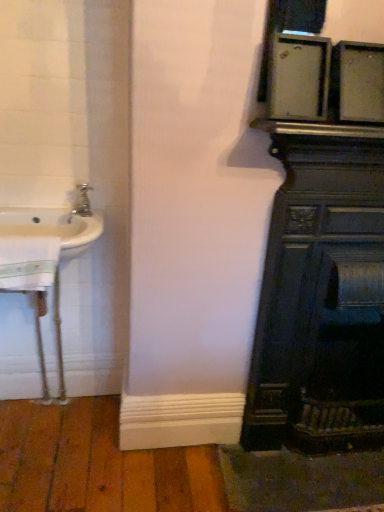
The image size is (384, 512). Describe the element at coordinates (81, 202) in the screenshot. I see `brushed metal faucet at left` at that location.

Where is `white glossy sink at left`? The height and width of the screenshot is (512, 384). white glossy sink at left is located at coordinates (57, 223).

Is white glossy sink at left far away from dark wood fireplace at right?

Actually, white glossy sink at left and dark wood fireplace at right are a little close together.

Is white glossy sink at left at the left side of dark wood fireplace at right?

Yes, white glossy sink at left is to the left of dark wood fireplace at right.

Consider the image. Choose the correct answer: Is white glossy sink at left inside dark wood fireplace at right or outside it?

white glossy sink at left lies outside dark wood fireplace at right.

Is brushed metal faucet at left with dark wood fireplace at right?

brushed metal faucet at left and dark wood fireplace at right are not in contact.

Consider the image. From a real-world perspective, is brushed metal faucet at left below dark wood fireplace at right?

No, from a real-world perspective, brushed metal faucet at left is not under dark wood fireplace at right.

Which object is wider, brushed metal faucet at left or dark wood fireplace at right?

With larger width is dark wood fireplace at right.

Is brushed metal faucet at left bigger or smaller than dark wood fireplace at right?

Clearly, brushed metal faucet at left is smaller in size than dark wood fireplace at right.

Find the location of `sink behind the dark wood fireplace at right`. sink behind the dark wood fireplace at right is located at coordinates (57, 223).

Is dark wood fireplace at right touching white glossy sink at left?

No, dark wood fireplace at right is not touching white glossy sink at left.

From a real-world perspective, which object rests below the other?

From a 3D spatial view, dark wood fireplace at right is below.

Considering the sizes of objects dark wood fireplace at right and white glossy sink at left in the image provided, who is shorter, dark wood fireplace at right or white glossy sink at left?

white glossy sink at left.

Is brushed metal faucet at left further to the viewer compared to white glossy sink at left?

Yes, it is.

From the picture: Which is more to the right, brushed metal faucet at left or white glossy sink at left?

From the viewer's perspective, brushed metal faucet at left appears more on the right side.

Is brushed metal faucet at left next to white glossy sink at left and touching it?

They are not placed beside each other.

Does brushed metal faucet at left have a lesser width compared to white glossy sink at left?

Yes.

Visually, is dark wood fireplace at right positioned to the left or to the right of brushed metal faucet at left?

dark wood fireplace at right is to the right of brushed metal faucet at left.

Can you confirm if dark wood fireplace at right is taller than brushed metal faucet at left?

Correct, dark wood fireplace at right is much taller as brushed metal faucet at left.

Is point (272, 323) closer or farther from the camera than point (79, 190)?

Point (272, 323) is closer to the camera than point (79, 190).

Which of these two, white glossy sink at left or brushed metal faucet at left, stands taller?

Standing taller between the two is white glossy sink at left.

Would you say white glossy sink at left contains brushed metal faucet at left?

Definitely not — brushed metal faucet at left is not inside white glossy sink at left.

Is white glossy sink at left placed right next to brushed metal faucet at left?

No, white glossy sink at left is not making contact with brushed metal faucet at left.

Is the position of white glossy sink at left more distant than that of brushed metal faucet at left?

No, white glossy sink at left is closer to the camera.

Find the location of a particular element. Image resolution: width=384 pixels, height=512 pixels. sink above the dark wood fireplace at right (from a real-world perspective) is located at coordinates (57, 223).

Where is `tap above the dark wood fireplace at right (from the image's perspective)`? This screenshot has width=384, height=512. tap above the dark wood fireplace at right (from the image's perspective) is located at coordinates (81, 202).

Looking at the image, which one is located closer to white glossy sink at left, brushed metal faucet at left or dark wood fireplace at right?

The object closer to white glossy sink at left is brushed metal faucet at left.

Which object lies further to the anchor point dark wood fireplace at right, brushed metal faucet at left or white glossy sink at left?

Based on the image, brushed metal faucet at left appears to be further to dark wood fireplace at right.

Which object lies nearer to the anchor point brushed metal faucet at left, dark wood fireplace at right or white glossy sink at left?

white glossy sink at left is positioned closer to the anchor brushed metal faucet at left.

Considering their positions, is white glossy sink at left positioned closer to brushed metal faucet at left than dark wood fireplace at right?

Among the two, white glossy sink at left is located nearer to brushed metal faucet at left.

Considering their positions, is white glossy sink at left positioned further to dark wood fireplace at right than brushed metal faucet at left?

Based on the image, brushed metal faucet at left appears to be further to dark wood fireplace at right.

Based on their spatial positions, is dark wood fireplace at right or brushed metal faucet at left closer to white glossy sink at left?

brushed metal faucet at left is positioned closer to the anchor white glossy sink at left.

Identify the location of tap situated between white glossy sink at left and dark wood fireplace at right from left to right. point(81,202).